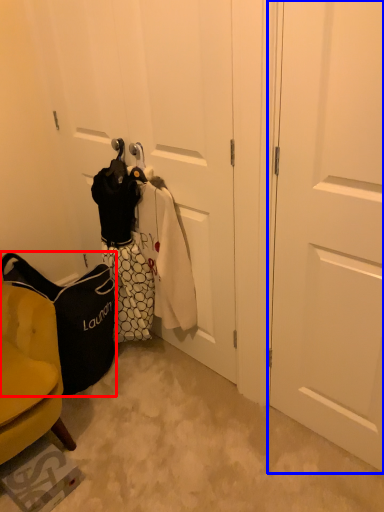
Question: Which point is further to the camera, handbag (highlighted by a red box) or door (highlighted by a blue box)?

Choices:
 (A) handbag
 (B) door

Answer: (A)